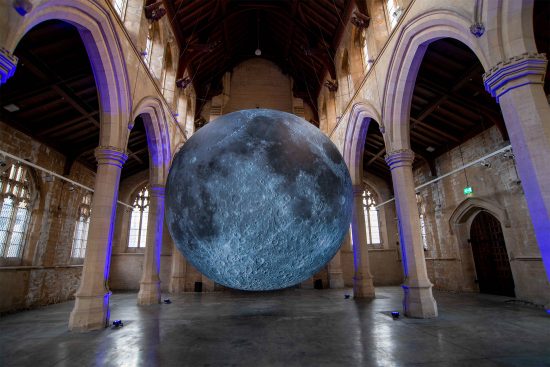
Where is `window`? window is located at coordinates (126, 242).